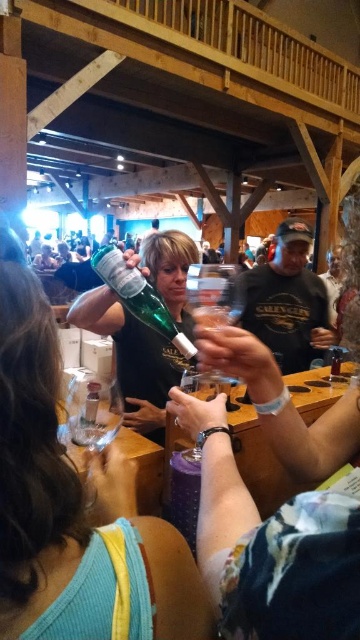
You are a wine taster standing at the pouring station in the tasting room. You need to reach a specific point marked at coordinates point (29,596). Your arm can extend 16 inches. Can you reach that point without moving your body?

The distance of point (29,596) from camera is 15.87 inches, so yes, you can reach it since your arm can extend 16 inches which is slightly longer than the distance required.

You are a guest at the wine tasting event and you want to pour wine from the green glass bottle at center into the transparent plastic wine glass at center. Which object should you hold first to pour the wine?

You should hold the green glass bottle at center first to pour the wine into the transparent plastic wine glass at center, as the bottle is positioned on the left side of the glass.

You are a bartender preparing to pour wine from the clear glass bottle at center into the transparent plastic wine glass at center. The bottle is full. Do you think the glass will overflow when you pour the entire contents of the bottle into it?

The transparent plastic wine glass at center is wider than the clear glass bottle at center, but since the question is about volume capacity, the width alone doesn not determine if the glass can hold the bottle content. Without information on the height or volume capacity of both objects, we cannot definitively say if the glass will overflow. More information is needed.